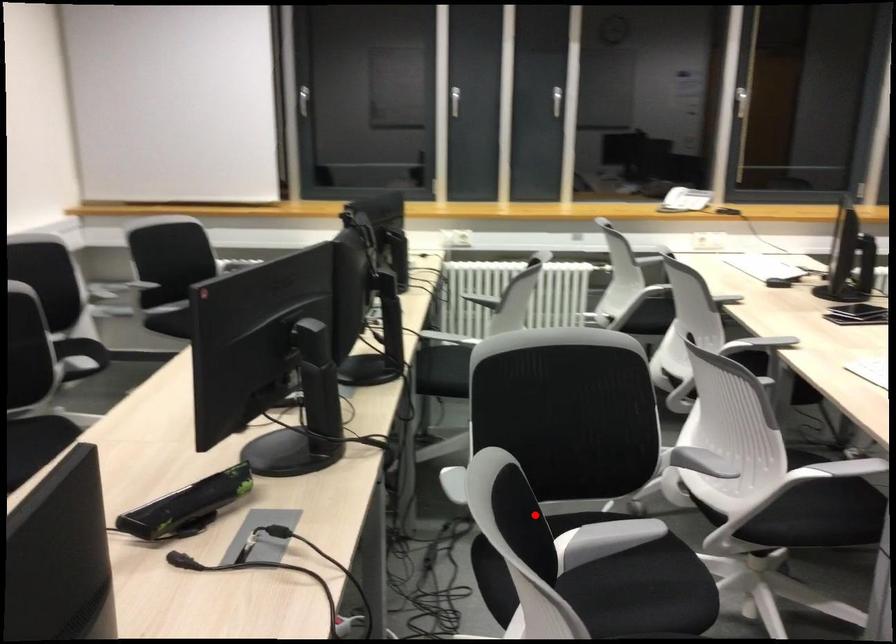
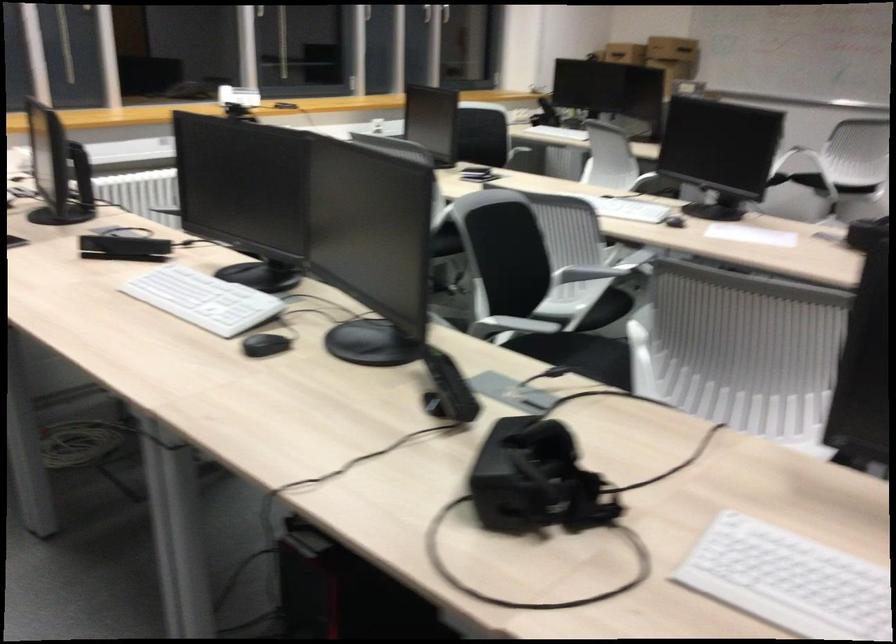
Question: I am providing you with two images of the same scene from different viewpoints. In image1, a red point is highlighted. Considering the same 3D point in image2, which of the following is correct?

Choices:
 (A) It is closer
 (B) It is farther

Answer: (B)